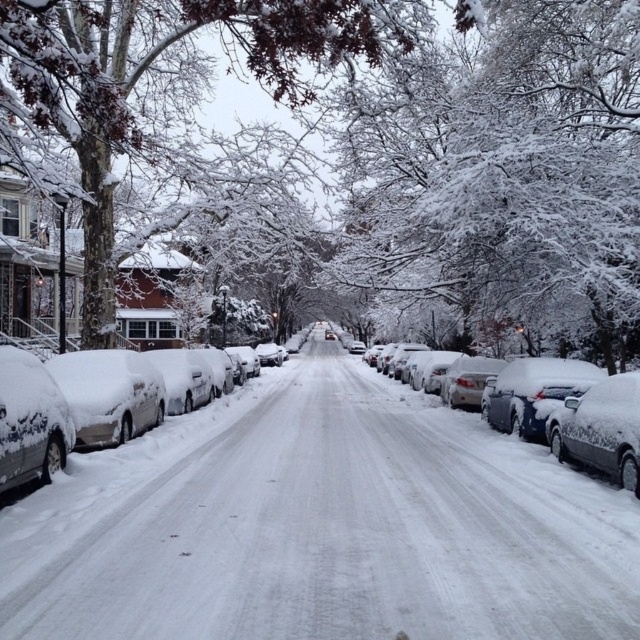
Between point (273, 44) and point (61, 404), which one is positioned in front?

Point (61, 404)

Between snow-covered tree at left and sleek silver sedan at left, which one has less height?

Standing shorter between the two is sleek silver sedan at left.

What do you see at coordinates (157, 72) in the screenshot? This screenshot has width=640, height=640. I see `snow-covered tree at left` at bounding box center [157, 72].

Find the location of `snow-covered tree at left`. snow-covered tree at left is located at coordinates (157, 72).

Can you confirm if white snow-covered tree at center is positioned above sleek silver sedan at left?

Yes, white snow-covered tree at center is above sleek silver sedan at left.

Between point (406, 252) and point (17, 384), which one is positioned in front?

Point (17, 384)

Is point (508, 276) more distant than point (68, 451)?

Yes, point (508, 276) is farther from viewer.

Find the location of `white snow-covered tree at center`. white snow-covered tree at center is located at coordinates (508, 172).

Which of these two, snow-covered sedan at center or sleek silver sedan at left, stands taller?

With more height is snow-covered sedan at center.

Does snow-covered sedan at center appear over sleek silver sedan at left?

Actually, snow-covered sedan at center is below sleek silver sedan at left.

Is point (621, 492) closer to camera compared to point (42, 388)?

That is False.

I want to click on snow-covered sedan at center, so click(x=461, y=428).